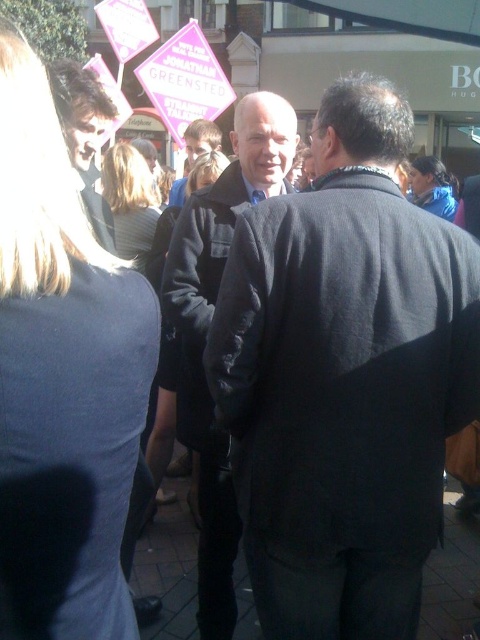
How far apart are matte black coat at center and dark brown hair at upper left?

matte black coat at center and dark brown hair at upper left are 1.01 meters apart from each other.

Is matte black coat at center below dark brown hair at upper left?

Indeed, matte black coat at center is positioned under dark brown hair at upper left.

Who is more forward, [225,582] or [100,99]?

Point [100,99]

This screenshot has width=480, height=640. Find the location of `matte black coat at center`. matte black coat at center is located at coordinates (207, 330).

Is matte black coat at center wider than smooth black jacket at center?

Yes.

Based on the photo, between matte black coat at center and smooth black jacket at center, which one has more height?

matte black coat at center is taller.

Locate an element on the screen. Image resolution: width=480 pixels, height=640 pixels. matte black coat at center is located at coordinates (x=207, y=330).

Is dark gray coat at center smaller than dark brown hair at upper left?

Actually, dark gray coat at center might be larger than dark brown hair at upper left.

Which is behind, point (424, 442) or point (93, 221)?

Positioned behind is point (93, 221).

The width and height of the screenshot is (480, 640). Identify the location of dark gray coat at center. (345, 378).